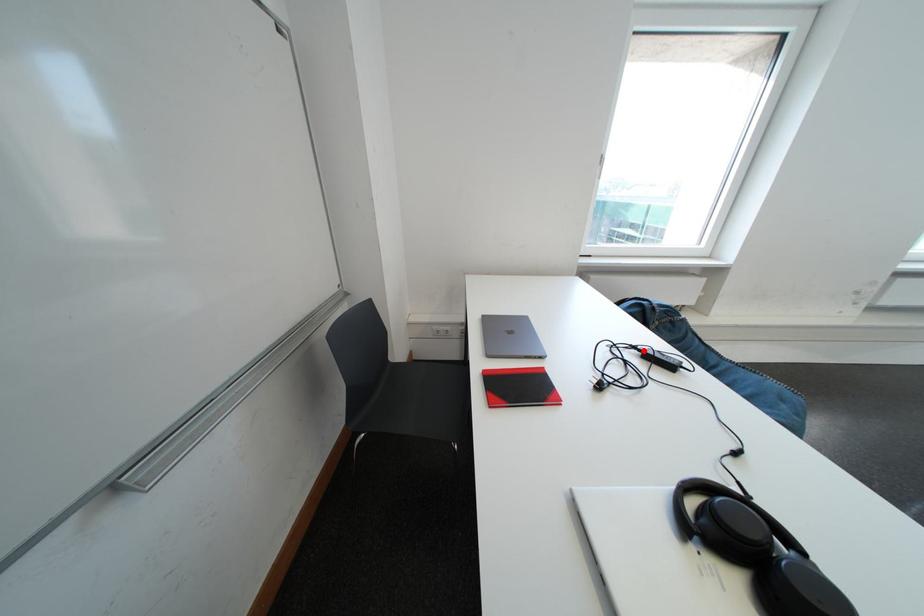
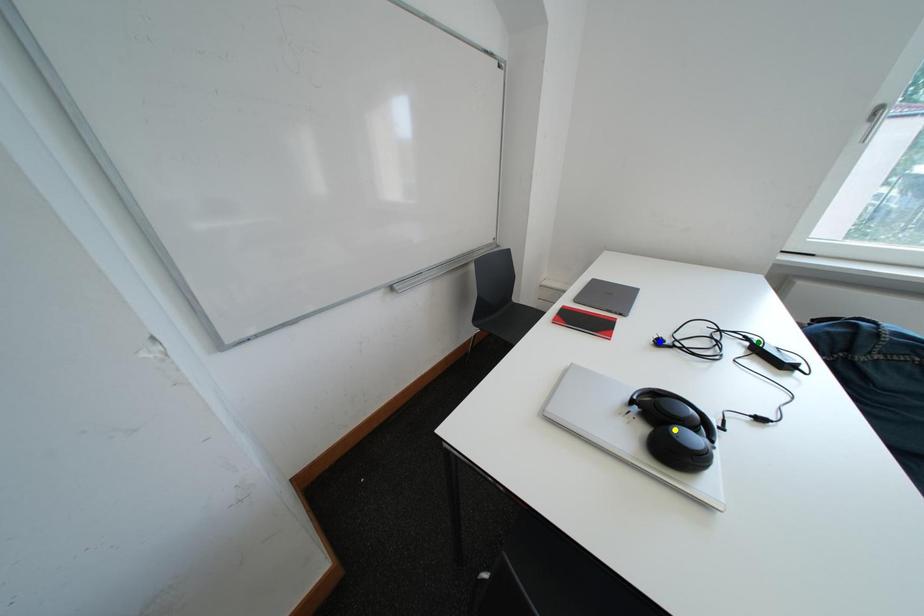
Question: I am providing you with two images of the same scene from different viewpoints. A red point is marked on the first image. You are given multiple points on the second image. Which point in image 2 is actually the same real-world point as the red point in image 1?

Choices:
 (A) blue point
 (B) yellow point
 (C) green point

Answer: (C)